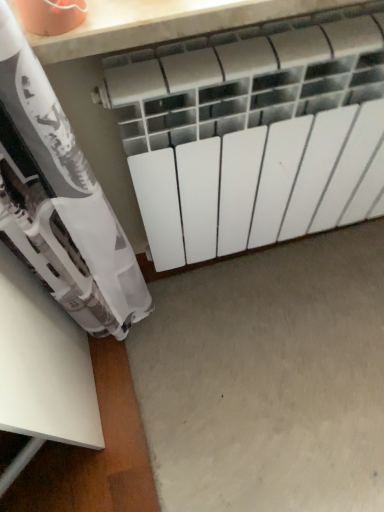
Question: Considering the relative sizes of white matte radiator at center and gray matte concrete at center in the image provided, is white matte radiator at center bigger than gray matte concrete at center?

Choices:
 (A) no
 (B) yes

Answer: (B)

Question: Does white matte radiator at center have a smaller size compared to gray matte concrete at center?

Choices:
 (A) yes
 (B) no

Answer: (B)

Question: From a real-world perspective, is white matte radiator at center over gray matte concrete at center?

Choices:
 (A) no
 (B) yes

Answer: (B)

Question: Is white matte radiator at center thinner than gray matte concrete at center?

Choices:
 (A) yes
 (B) no

Answer: (A)

Question: Considering the relative sizes of white matte radiator at center and gray matte concrete at center in the image provided, is white matte radiator at center wider than gray matte concrete at center?

Choices:
 (A) yes
 (B) no

Answer: (B)

Question: From the image's perspective, is white matte radiator at center over gray matte concrete at center?

Choices:
 (A) no
 (B) yes

Answer: (B)

Question: Is gray matte concrete at center looking in the opposite direction of white matte radiator at center?

Choices:
 (A) no
 (B) yes

Answer: (A)

Question: From a real-world perspective, is gray matte concrete at center on top of white matte radiator at center?

Choices:
 (A) no
 (B) yes

Answer: (A)

Question: From a real-world perspective, is gray matte concrete at center beneath white matte radiator at center?

Choices:
 (A) yes
 (B) no

Answer: (A)

Question: Is gray matte concrete at center at the right side of white matte radiator at center?

Choices:
 (A) no
 (B) yes

Answer: (B)

Question: Can you confirm if gray matte concrete at center is smaller than white matte radiator at center?

Choices:
 (A) yes
 (B) no

Answer: (A)

Question: From the image's perspective, is gray matte concrete at center beneath white matte radiator at center?

Choices:
 (A) no
 (B) yes

Answer: (B)

Question: Would you say gray matte concrete at center is inside or outside white matte radiator at center?

Choices:
 (A) inside
 (B) outside

Answer: (B)